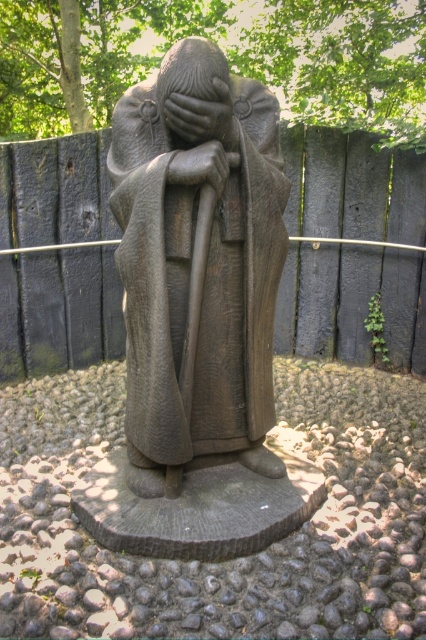
Question: Can you confirm if black wood fence at center is smaller than dark gray stone hand at center?

Choices:
 (A) yes
 (B) no

Answer: (B)

Question: Which of these objects is positioned closest to the smooth stone hand at center?

Choices:
 (A) bronze statue at center
 (B) black wood fence at center
 (C) dark gray stone hand at center

Answer: (C)

Question: Is black wood fence at center positioned at the back of dark gray stone hand at center?

Choices:
 (A) yes
 (B) no

Answer: (A)

Question: Can you confirm if dark gray stone hand at center is positioned to the right of smooth stone hand at center?

Choices:
 (A) yes
 (B) no

Answer: (B)

Question: Which object appears closest to the camera in this image?

Choices:
 (A) bronze statue at center
 (B) dark gray stone hand at center

Answer: (B)

Question: Which object is positioned closest to the smooth stone hand at center?

Choices:
 (A) dark gray stone hand at center
 (B) black wood fence at center
 (C) bronze statue at center

Answer: (A)